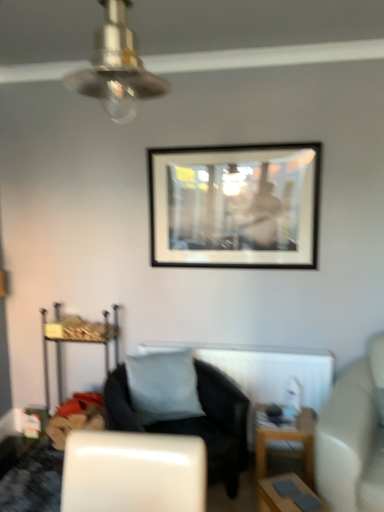
Where is `free point above smooth wooden table at lower right, the second table when ordered from back to front (from a real-world perspective)`? free point above smooth wooden table at lower right, the second table when ordered from back to front (from a real-world perspective) is located at coordinates coord(296,495).